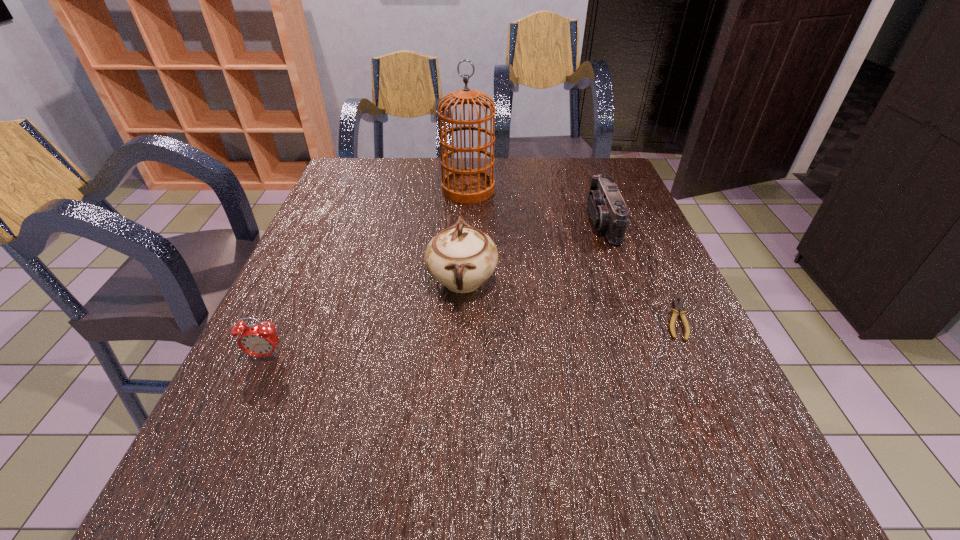
The height and width of the screenshot is (540, 960). I want to click on vacant space located 0.080m on the front-facing side of the fourth object from left to right, so click(x=559, y=222).

Where is `vacant space located on the front-facing side of the fourth object from left to right`? The height and width of the screenshot is (540, 960). vacant space located on the front-facing side of the fourth object from left to right is located at coordinates (444, 222).

I want to click on vacant space situated on the face of the leftmost object, so click(x=246, y=399).

At what (x,y) coordinates should I click in order to perform the action: click on free space located on the left of the pliers. Please return your answer as a coordinate pair (x, y). The image size is (960, 540). Looking at the image, I should click on (563, 319).

Image resolution: width=960 pixels, height=540 pixels. Identify the location of object located at the far edge. (468, 185).

Locate an element on the screen. This screenshot has width=960, height=540. object at the left edge is located at coordinates (260, 340).

Identify the location of camcorder that is at the right edge. (608, 211).

Where is `pliers located at the right edge`? The height and width of the screenshot is (540, 960). pliers located at the right edge is located at coordinates (678, 307).

The height and width of the screenshot is (540, 960). In order to click on vacant space at the far edge of the desktop in this screenshot , I will do `click(411, 185)`.

Locate an element on the screen. This screenshot has width=960, height=540. free spot at the near edge of the desktop is located at coordinates (617, 511).